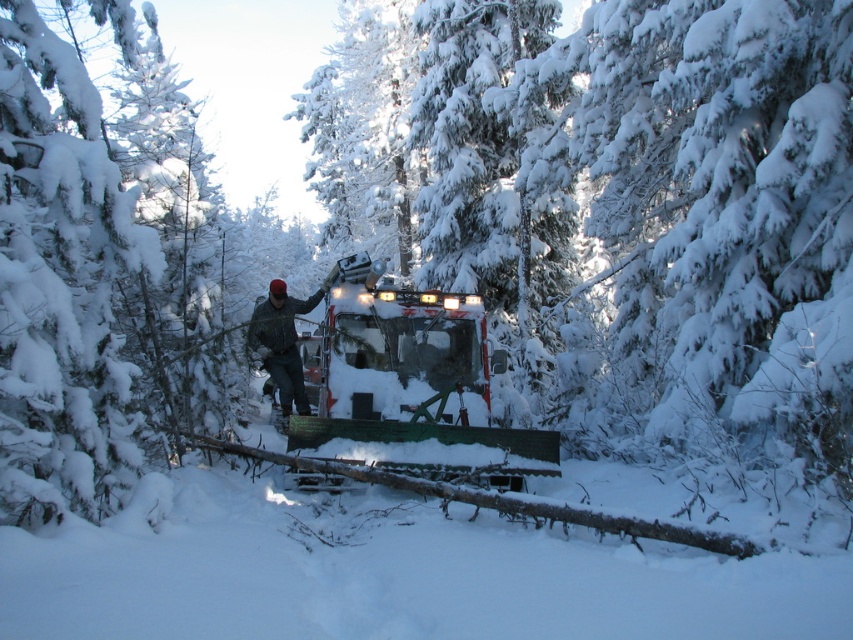
You are a hiker lost in a snowy forest. You see a metallic silver snowmobile at center and a camouflage jacket at center. Which object is positioned more to the right from your perspective?

The metallic silver snowmobile at center is to the right of the camouflage jacket at center, so the metallic silver snowmobile at center is positioned more to the right.